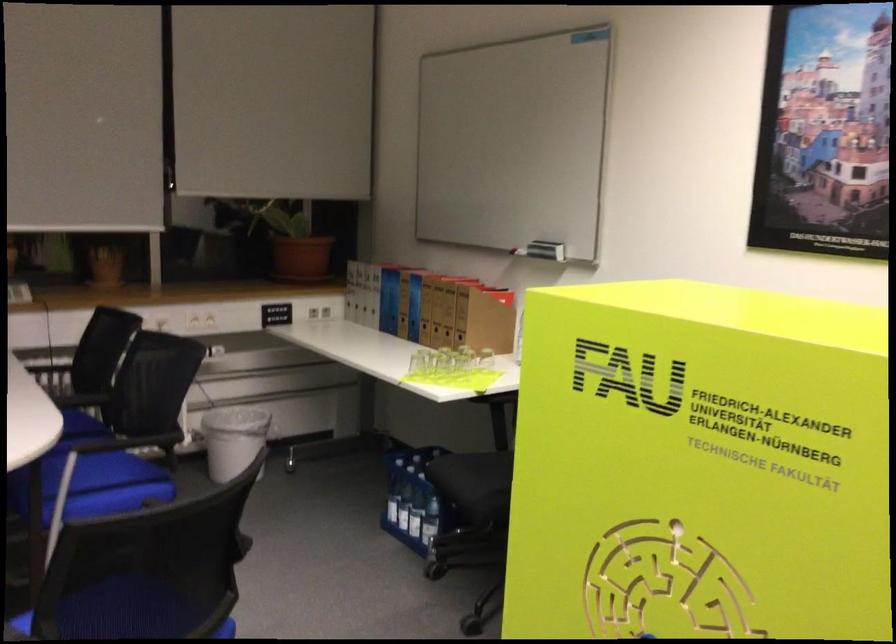
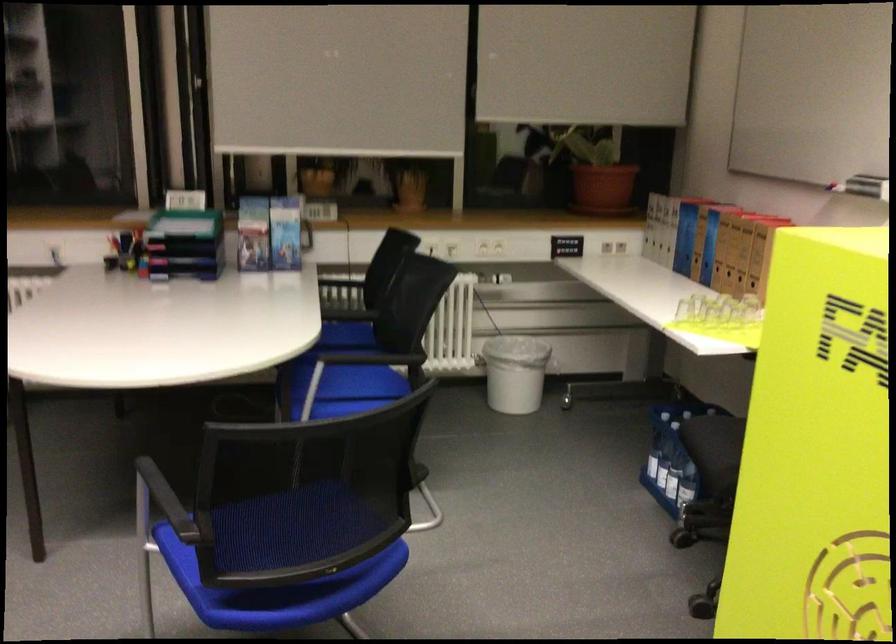
Question: I am providing you with two images of the same scene from different viewpoints. Please identify which objects are invisible in image2.

Choices:
 (A) small glass cup
 (B) brown ring binder
 (C) white oval magnet
 (D) clear water bottle

Answer: (A)